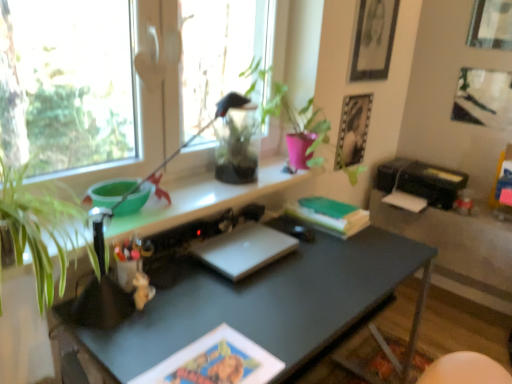
You are a GUI agent. You are given a task and a screenshot of the screen. Output one action in this format:
    pyautogui.click(x=<x>, y=<y>)
    Task: Click on the free space in front of sleek silver laptop at center
    This screenshot has height=384, width=512.
    Given the screenshot: What is the action you would take?
    pyautogui.click(x=239, y=300)